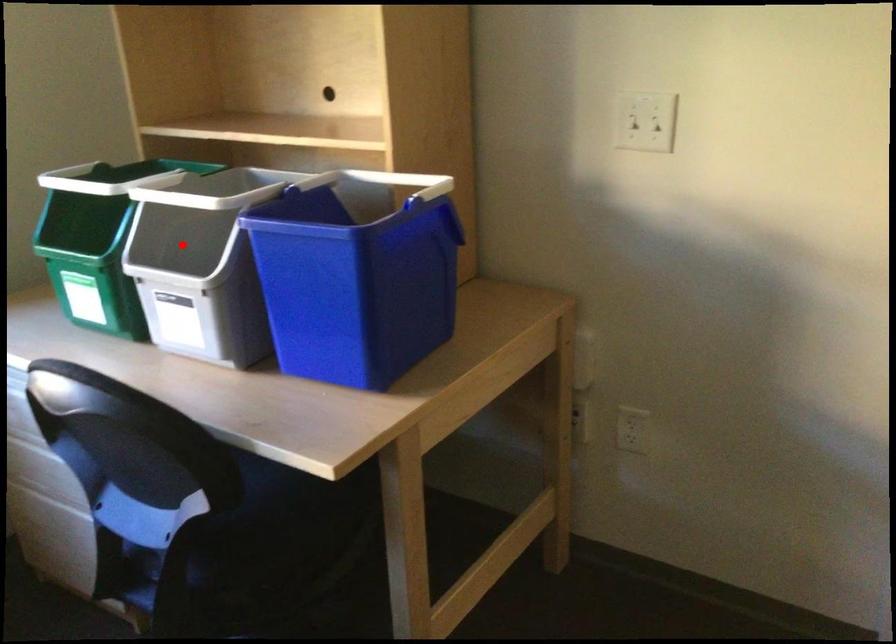
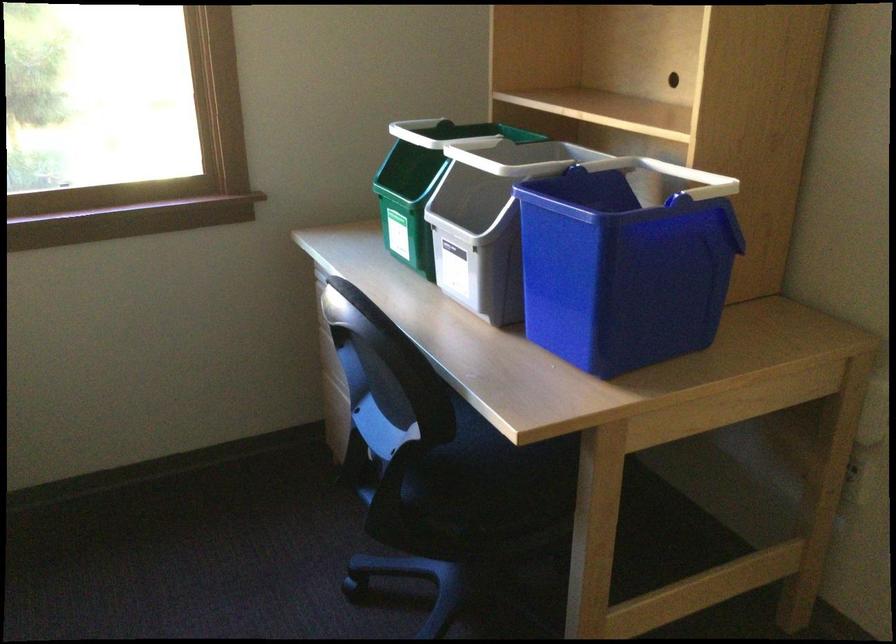
Where in the second image is the point corresponding to the highlighted location from the first image?

(479, 201)